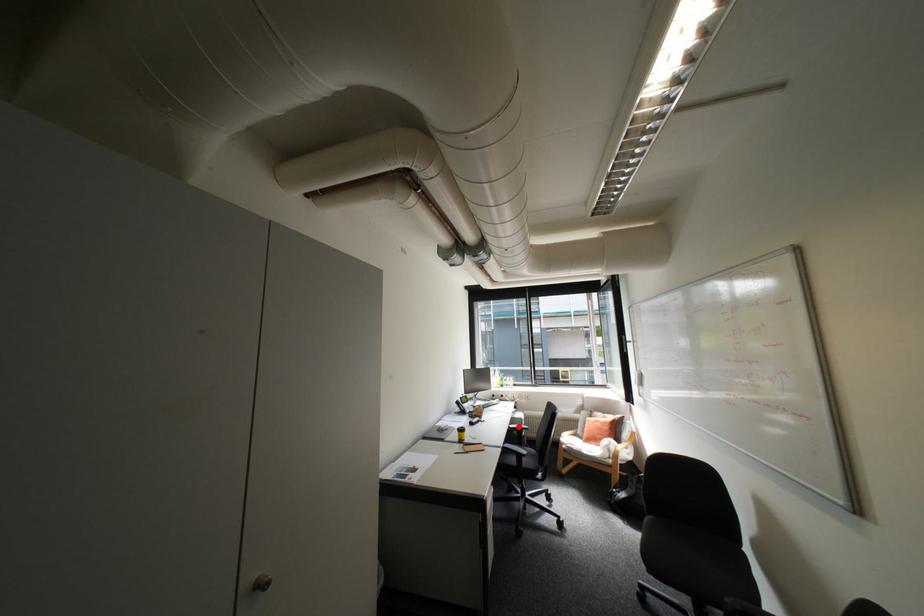
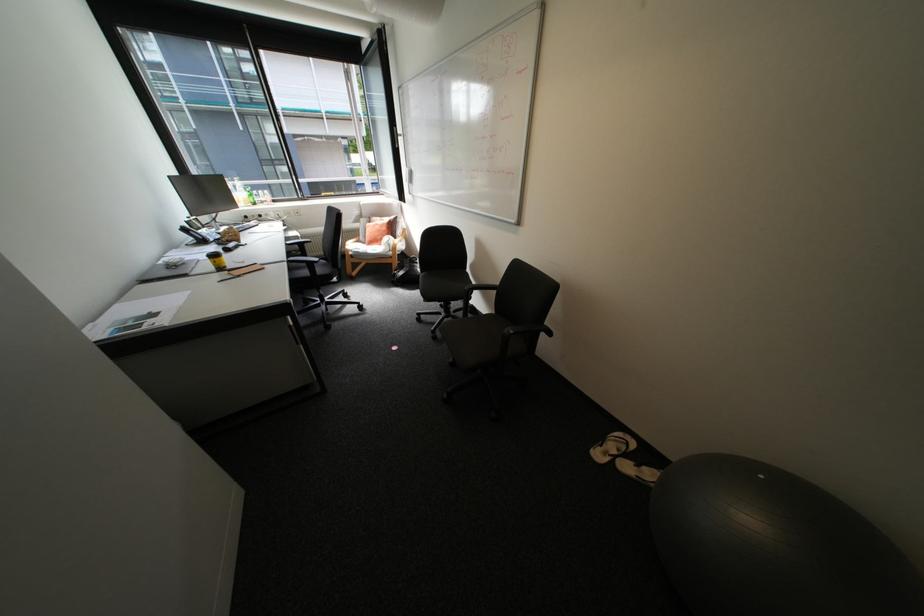
Question: I am providing you with two images of the same scene from different viewpoints. In image1, a red point is highlighted. Considering the same 3D point in image2, which of the following is correct?

Choices:
 (A) It is closer
 (B) It is farther

Answer: (A)